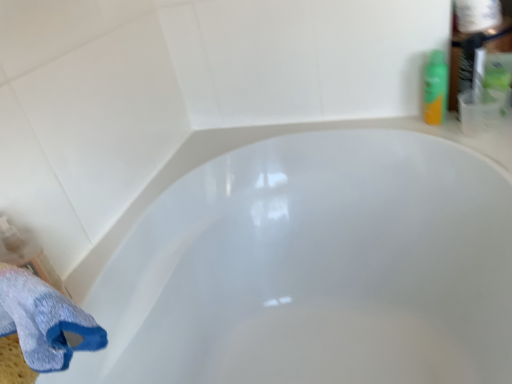
In order to face green plastic spray can at upper right, should I rotate leftwards or rightwards?

You should rotate right by 22.993 degrees.

This screenshot has height=384, width=512. What do you see at coordinates (477, 15) in the screenshot?
I see `white paper towel at upper right` at bounding box center [477, 15].

Image resolution: width=512 pixels, height=384 pixels. I want to click on white paper towel at upper right, so click(x=477, y=15).

Describe the element at coordinates (309, 263) in the screenshot. I see `white glossy bathtub at center` at that location.

Where is `blue textured bath towel at lower left`? This screenshot has height=384, width=512. blue textured bath towel at lower left is located at coordinates (40, 326).

You are a GUI agent. You are given a task and a screenshot of the screen. Output one action in this format:
    pyautogui.click(x=<x>, y=<y>)
    Task: Click on the green plastic spray can at upper right
    
    Given the screenshot: What is the action you would take?
    pyautogui.click(x=435, y=88)

Does green plastic spray can at upper right have a larger size compared to blue textured bath towel at lower left?

Actually, green plastic spray can at upper right might be smaller than blue textured bath towel at lower left.

Which is more to the left, green plastic spray can at upper right or blue textured bath towel at lower left?

From the viewer's perspective, blue textured bath towel at lower left appears more on the left side.

Consider the image. In terms of width, does green plastic spray can at upper right look wider or thinner when compared to blue textured bath towel at lower left?

In the image, green plastic spray can at upper right appears to be more narrow than blue textured bath towel at lower left.

In the image, is white paper towel at upper right on the left side or the right side of blue textured bath towel at lower left?

Based on their positions, white paper towel at upper right is located to the right of blue textured bath towel at lower left.

Between white paper towel at upper right and blue textured bath towel at lower left, which one has larger width?

With larger width is blue textured bath towel at lower left.

Based on the photo, how distant is white paper towel at upper right from blue textured bath towel at lower left?

3.53 feet.

Looking at this image, is white paper towel at upper right directly adjacent to blue textured bath towel at lower left?

There is a gap between white paper towel at upper right and blue textured bath towel at lower left.

I want to click on bathtub below the green plastic spray can at upper right (from a real-world perspective), so click(x=309, y=263).

From a real-world perspective, is white glossy bathtub at center physically below green plastic spray can at upper right?

Correct, in the physical world, white glossy bathtub at center is lower than green plastic spray can at upper right.

Can you confirm if white glossy bathtub at center is positioned to the left of green plastic spray can at upper right?

Yes, white glossy bathtub at center is to the left of green plastic spray can at upper right.

Is green plastic spray can at upper right a part of white glossy bathtub at center?

No, green plastic spray can at upper right is not a part of white glossy bathtub at center.

Is point (496, 1) positioned before point (319, 381)?

Yes, it is in front of point (319, 381).

How different are the orientations of white paper towel at upper right and white glossy bathtub at center in degrees?

89.8 degrees separate the facing orientations of white paper towel at upper right and white glossy bathtub at center.

Is white paper towel at upper right in contact with white glossy bathtub at center?

They are not placed beside each other.

From the picture: Which object is more forward, white paper towel at upper right or white glossy bathtub at center?

white glossy bathtub at center is more forward.

Which of these two, white paper towel at upper right or green plastic spray can at upper right, is wider?

white paper towel at upper right.

Which is more to the left, white paper towel at upper right or green plastic spray can at upper right?

green plastic spray can at upper right is more to the left.

Who is taller, white paper towel at upper right or green plastic spray can at upper right?

green plastic spray can at upper right.

From a real-world perspective, relative to white paper towel at upper right, is blue textured bath towel at lower left vertically above or below?

From a real-world perspective, blue textured bath towel at lower left is physically below white paper towel at upper right.

Which point is more forward, (x=89, y=328) or (x=500, y=5)?

Point (x=89, y=328)

How distant is blue textured bath towel at lower left from white paper towel at upper right?

blue textured bath towel at lower left is 1.07 meters from white paper towel at upper right.

Does blue textured bath towel at lower left appear on the left side of white glossy bathtub at center?

Yes.

Is blue textured bath towel at lower left spatially inside white glossy bathtub at center, or outside of it?

blue textured bath towel at lower left is spatially situated outside white glossy bathtub at center.

Does blue textured bath towel at lower left have a larger size compared to white glossy bathtub at center?

Actually, blue textured bath towel at lower left might be smaller than white glossy bathtub at center.

Locate an element on the screen. Image resolution: width=512 pixels, height=384 pixels. toiletry above the blue textured bath towel at lower left (from the image's perspective) is located at coordinates (435, 88).

Identify the location of toilet paper on the right of blue textured bath towel at lower left. [x=477, y=15].

From the image, which object appears to be farther from white glossy bathtub at center, blue textured bath towel at lower left or green plastic spray can at upper right?

blue textured bath towel at lower left lies further to white glossy bathtub at center than the other object.

Considering their positions, is green plastic spray can at upper right positioned further to white glossy bathtub at center than white paper towel at upper right?

Based on the image, white paper towel at upper right appears to be further to white glossy bathtub at center.

When comparing their distances from green plastic spray can at upper right, does white paper towel at upper right or blue textured bath towel at lower left seem closer?

white paper towel at upper right is positioned closer to the anchor green plastic spray can at upper right.

Which object lies nearer to the anchor point green plastic spray can at upper right, white glossy bathtub at center or blue textured bath towel at lower left?

The object closer to green plastic spray can at upper right is white glossy bathtub at center.

In the scene shown: From the image, which object appears to be farther from blue textured bath towel at lower left, white glossy bathtub at center or white paper towel at upper right?

The object further to blue textured bath towel at lower left is white paper towel at upper right.

When comparing their distances from white paper towel at upper right, does blue textured bath towel at lower left or green plastic spray can at upper right seem further?

blue textured bath towel at lower left.

Looking at the image, which one is located closer to green plastic spray can at upper right, white paper towel at upper right or white glossy bathtub at center?

white paper towel at upper right.

Looking at the image, which one is located further to blue textured bath towel at lower left, green plastic spray can at upper right or white paper towel at upper right?

white paper towel at upper right lies further to blue textured bath towel at lower left than the other object.

I want to click on bathtub between blue textured bath towel at lower left and white paper towel at upper right from left to right, so click(x=309, y=263).

The height and width of the screenshot is (384, 512). In order to click on toiletry between white paper towel at upper right and white glossy bathtub at center vertically in this screenshot , I will do `click(435, 88)`.

This screenshot has width=512, height=384. Identify the location of bathtub between blue textured bath towel at lower left and green plastic spray can at upper right in the horizontal direction. (309, 263).

Locate an element on the screen. toiletry between blue textured bath towel at lower left and white paper towel at upper right from left to right is located at coordinates (435, 88).